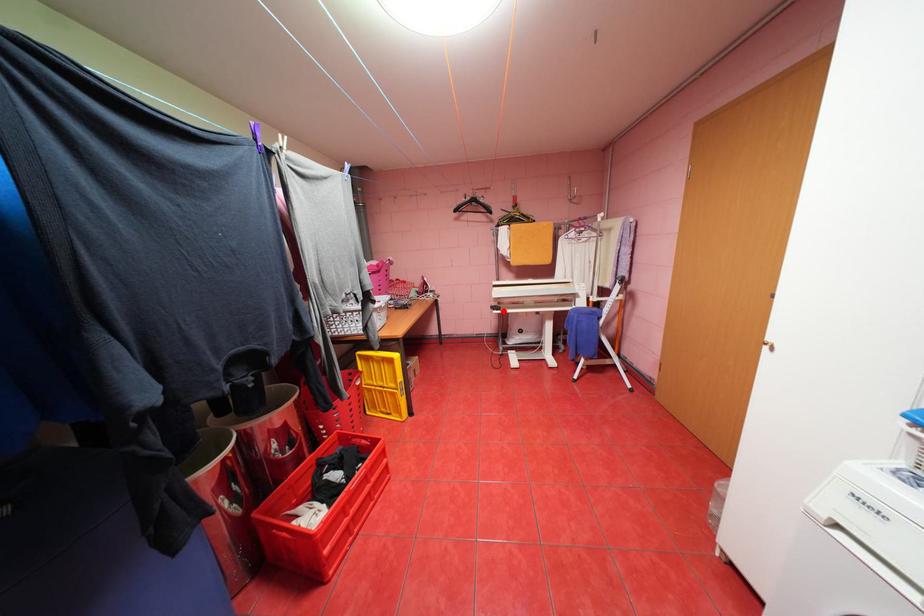
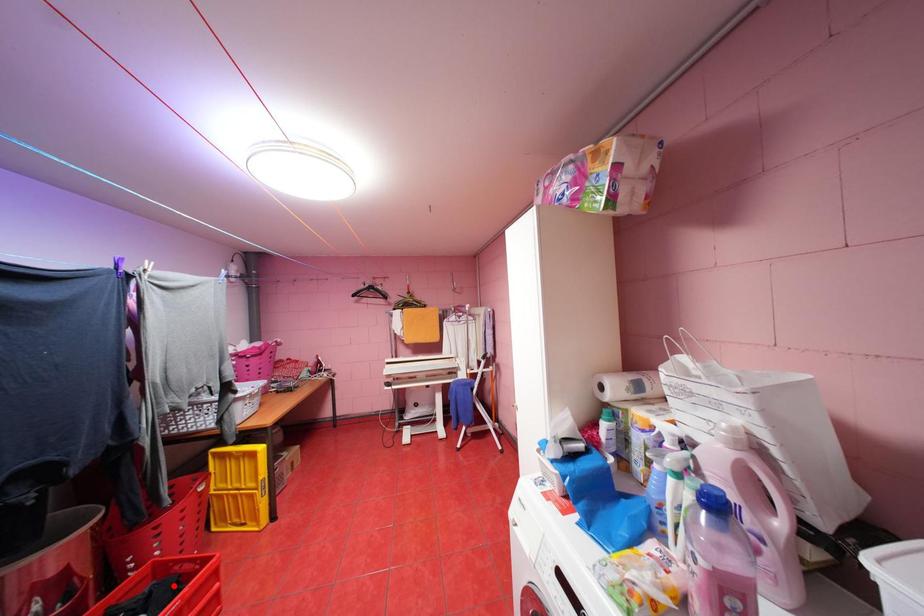
I am providing you with two images of the same scene from different viewpoints. A red point is marked on the first image and another point is marked on the second image. Is the marked point in image1 the same physical position as the marked point in image2?

No